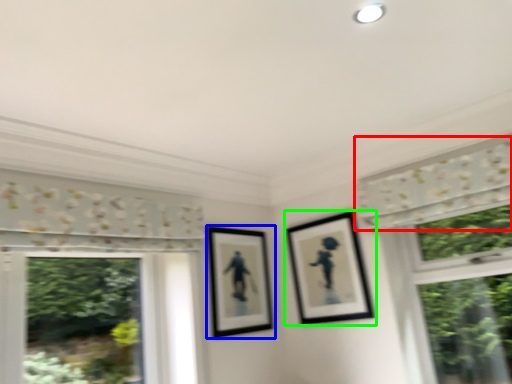
Question: Considering the real-world distances, which object is farthest from curtain (highlighted by a red box)? picture frame (highlighted by a blue box) or picture frame (highlighted by a green box)?

Choices:
 (A) picture frame
 (B) picture frame

Answer: (A)